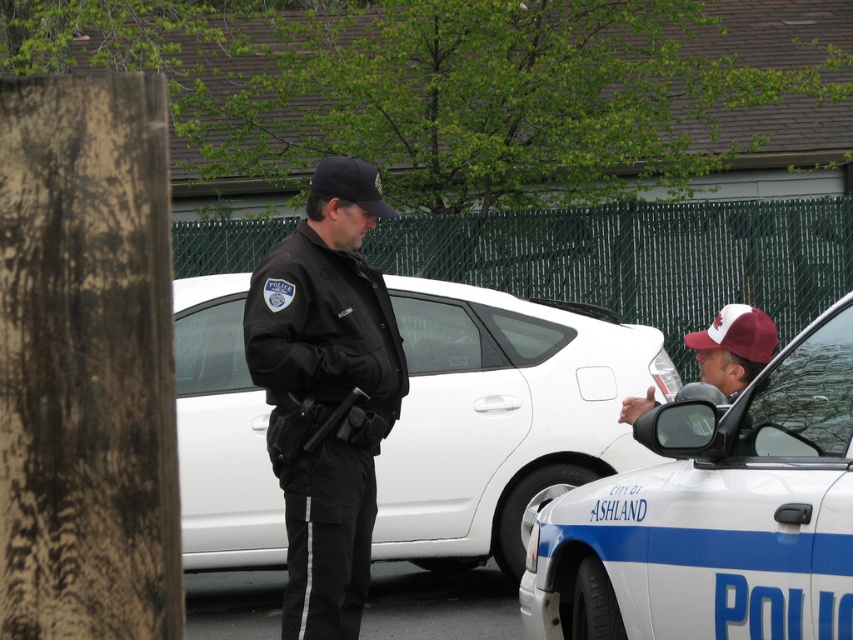
Who is shorter, white matte car at center or white glossy police car at right?

white glossy police car at right is shorter.

This screenshot has height=640, width=853. Find the location of `white matte car at center`. white matte car at center is located at coordinates (502, 419).

Locate an element on the screen. This screenshot has width=853, height=640. white matte car at center is located at coordinates (502, 419).

At what (x,y) coordinates should I click in order to perform the action: click on white matte car at center. Please return your answer as a coordinate pair (x, y). The image size is (853, 640). Looking at the image, I should click on (x=502, y=419).

Can you confirm if white matte car at center is thinner than black uniform at center?

No, white matte car at center is not thinner than black uniform at center.

Is point (212, 419) closer to viewer compared to point (323, 420)?

No, (212, 419) is further to viewer.

At what (x,y) coordinates should I click in order to perform the action: click on white matte car at center. Please return your answer as a coordinate pair (x, y). Looking at the image, I should click on (502, 419).

Is the position of white matte car at center more distant than that of maroon fabric cap at right?

Yes.

Is point (590, 378) more distant than point (751, 342)?

Yes, point (590, 378) is farther from viewer.

The width and height of the screenshot is (853, 640). Describe the element at coordinates (502, 419) in the screenshot. I see `white matte car at center` at that location.

Image resolution: width=853 pixels, height=640 pixels. In order to click on white matte car at center in this screenshot , I will do `click(502, 419)`.